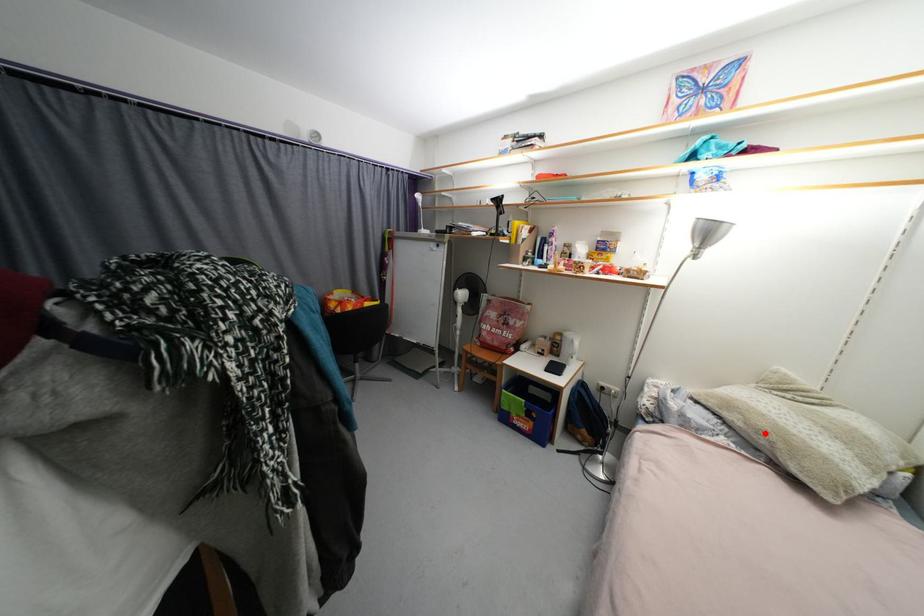
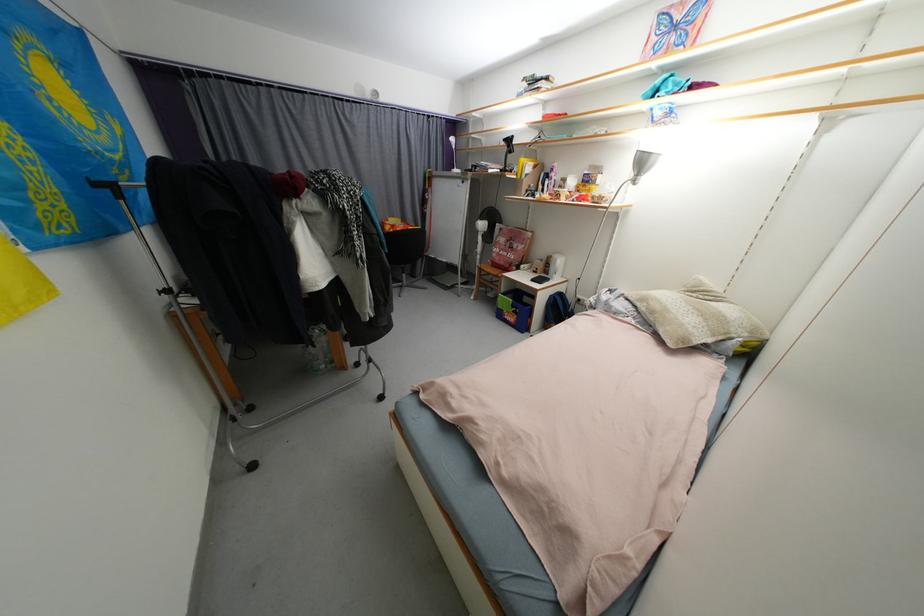
Question: I am providing you with two images of the same scene from different viewpoints. Image1 has a red point marked. In image2, the corresponding 3D location appears at what relative position? Reply with the corresponding letter.

Choices:
 (A) Closer
 (B) Farther

Answer: (A)